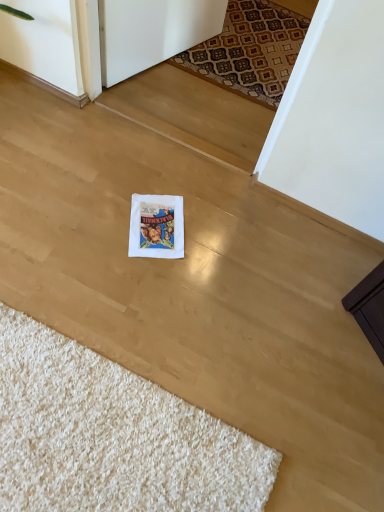
Question: Would you say patterned carpet at upper center contains white paper postcard at center?

Choices:
 (A) no
 (B) yes

Answer: (A)

Question: Can you confirm if patterned carpet at upper center is taller than white paper postcard at center?

Choices:
 (A) no
 (B) yes

Answer: (B)

Question: Does patterned carpet at upper center appear on the right side of white paper postcard at center?

Choices:
 (A) no
 (B) yes

Answer: (B)

Question: Does patterned carpet at upper center have a larger size compared to white paper postcard at center?

Choices:
 (A) yes
 (B) no

Answer: (A)

Question: Can you confirm if patterned carpet at upper center is positioned to the left of white paper postcard at center?

Choices:
 (A) yes
 (B) no

Answer: (B)

Question: From the image's perspective, is patterned carpet at upper center above or below white shaggy rug at lower left?

Choices:
 (A) below
 (B) above

Answer: (B)

Question: From their relative heights in the image, would you say patterned carpet at upper center is taller or shorter than white shaggy rug at lower left?

Choices:
 (A) short
 (B) tall

Answer: (A)

Question: Is point (226, 79) positioned closer to the camera than point (54, 480)?

Choices:
 (A) closer
 (B) farther

Answer: (B)

Question: Which is correct: patterned carpet at upper center is inside white shaggy rug at lower left, or outside of it?

Choices:
 (A) outside
 (B) inside

Answer: (A)

Question: In terms of width, does white paper postcard at center look wider or thinner when compared to white shaggy rug at lower left?

Choices:
 (A) thin
 (B) wide

Answer: (A)

Question: Considering the positions of white paper postcard at center and white shaggy rug at lower left in the image, is white paper postcard at center bigger or smaller than white shaggy rug at lower left?

Choices:
 (A) big
 (B) small

Answer: (B)

Question: From a real-world perspective, is white paper postcard at center positioned above or below white shaggy rug at lower left?

Choices:
 (A) above
 (B) below

Answer: (B)

Question: Considering the positions of point (153, 221) and point (119, 437), is point (153, 221) closer or farther from the camera than point (119, 437)?

Choices:
 (A) farther
 (B) closer

Answer: (A)

Question: From the image's perspective, is patterned carpet at upper center located above or below white paper postcard at center?

Choices:
 (A) above
 (B) below

Answer: (A)

Question: Looking at the image, does patterned carpet at upper center seem bigger or smaller compared to white paper postcard at center?

Choices:
 (A) big
 (B) small

Answer: (A)